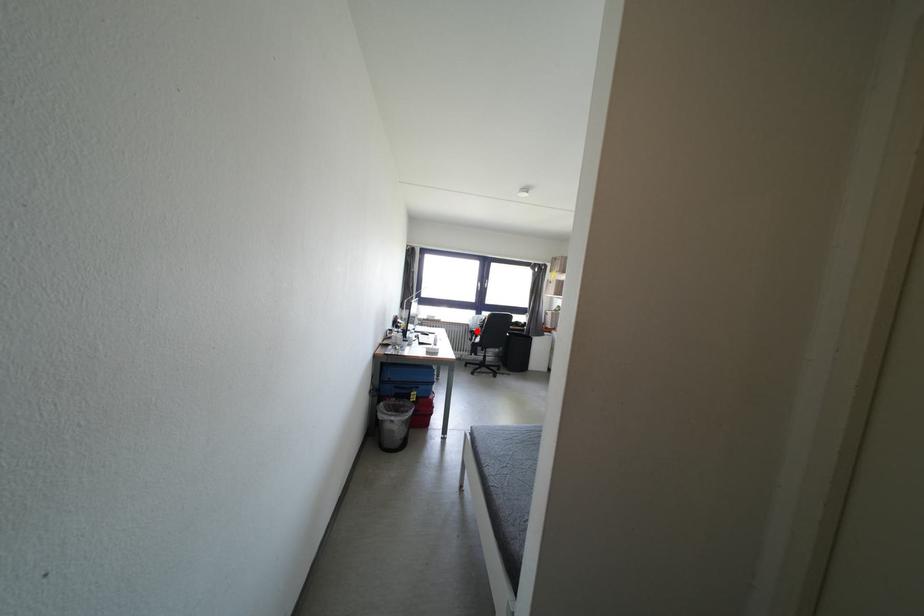
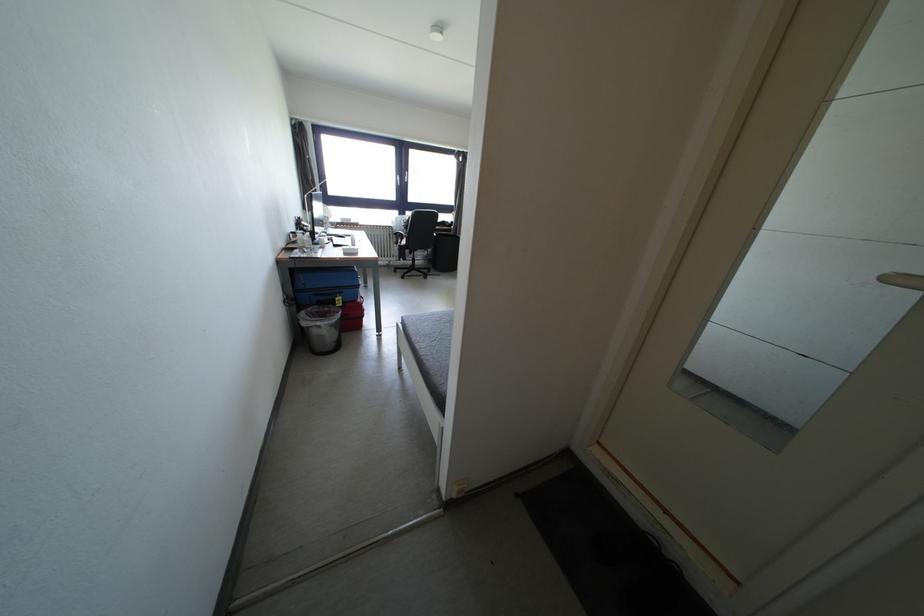
Question: I am providing you with two images of the same scene from different viewpoints. In image1, a red point is highlighted. Considering the same 3D point in image2, which of the following is correct?

Choices:
 (A) It is closer
 (B) It is farther

Answer: (A)